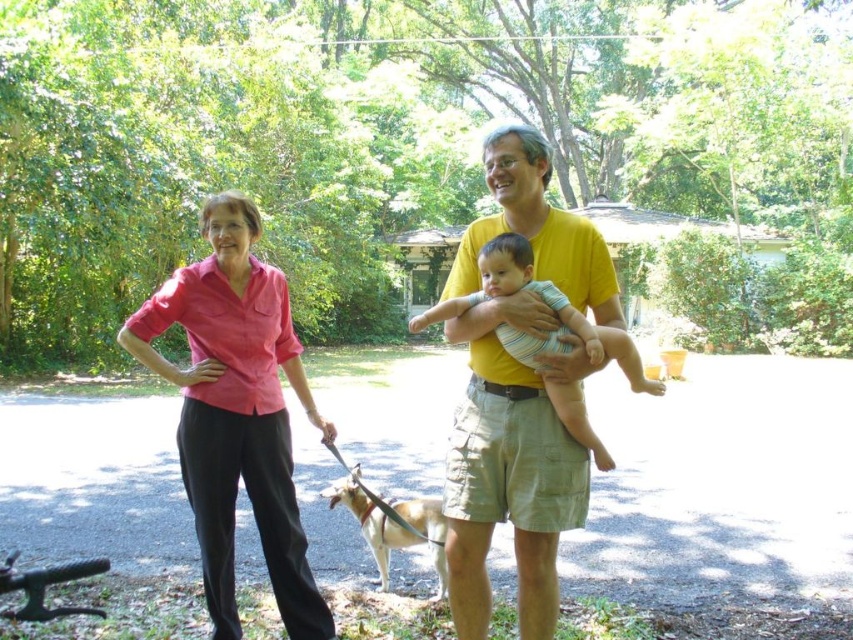
Consider the image. You are trying to decide which shirt to wear for a day hike. You see the yellow cotton shirt at center and the pink linen shirt at left. Which shirt is more likely to be comfortable in warm weather?

The yellow cotton shirt at center is thinner than the pink linen shirt at left, so it is more likely to be comfortable in warm weather.

You are a photographer trying to capture the pink cotton shirt at upper left in the center of your camera frame. Given its current position at point coordinates, can you confirm if the shirt is already centered?

The pink cotton shirt at upper left is located at coordinates point (x=524, y=392), which means it is not centered in the frame since the center would be at (x=426, y=320).

Based on the photo, you are standing in the residential area surrounded by trees and bushes. You see a yellow cotton shirt at center and a pink linen shirt at left. Which shirt is closer to you?

The yellow cotton shirt at center is closer to you because it is in front of the pink linen shirt at left.